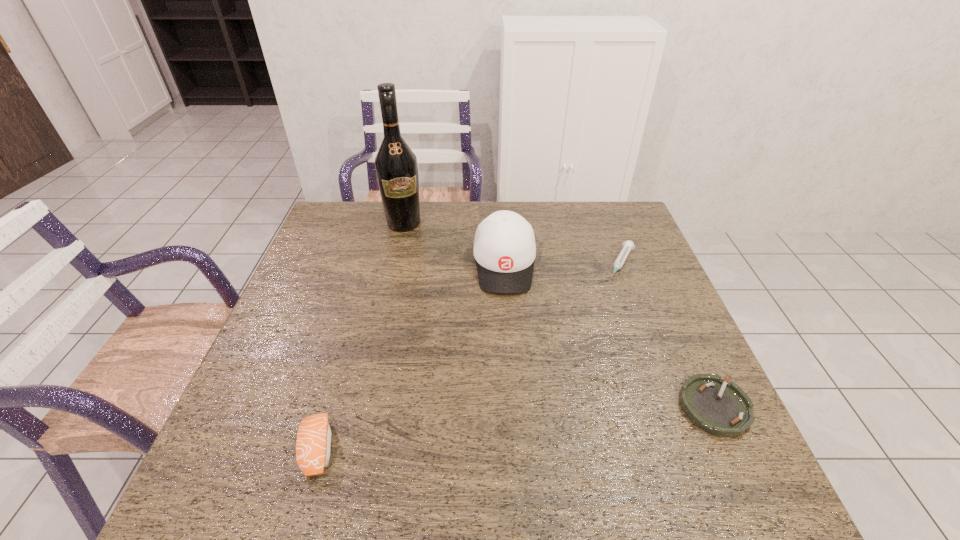
Locate an element on the screen. Image resolution: width=960 pixels, height=540 pixels. sushi that is at the near edge is located at coordinates (313, 443).

Locate an element on the screen. This screenshot has height=540, width=960. ashtray located in the near edge section of the desktop is located at coordinates (722, 409).

Find the location of a particular element. ashtray present at the right edge is located at coordinates (722, 409).

Identify the location of syringe that is at the right edge. The image size is (960, 540). (628, 245).

Image resolution: width=960 pixels, height=540 pixels. What are the coordinates of `object located in the near right corner section of the desktop` in the screenshot? It's located at tap(722, 409).

Locate an element on the screen. vacant space at the far edge is located at coordinates (571, 227).

At what (x,y) coordinates should I click in order to perform the action: click on vacant space at the near edge. Please return your answer as a coordinate pair (x, y). The height and width of the screenshot is (540, 960). Looking at the image, I should click on (372, 437).

Locate an element on the screen. free space at the left edge is located at coordinates (314, 275).

This screenshot has width=960, height=540. In order to click on blank space at the right edge of the desktop in this screenshot , I will do `click(684, 350)`.

The height and width of the screenshot is (540, 960). In the image, there is a desktop. Identify the location of vacant space at the far left corner. (328, 220).